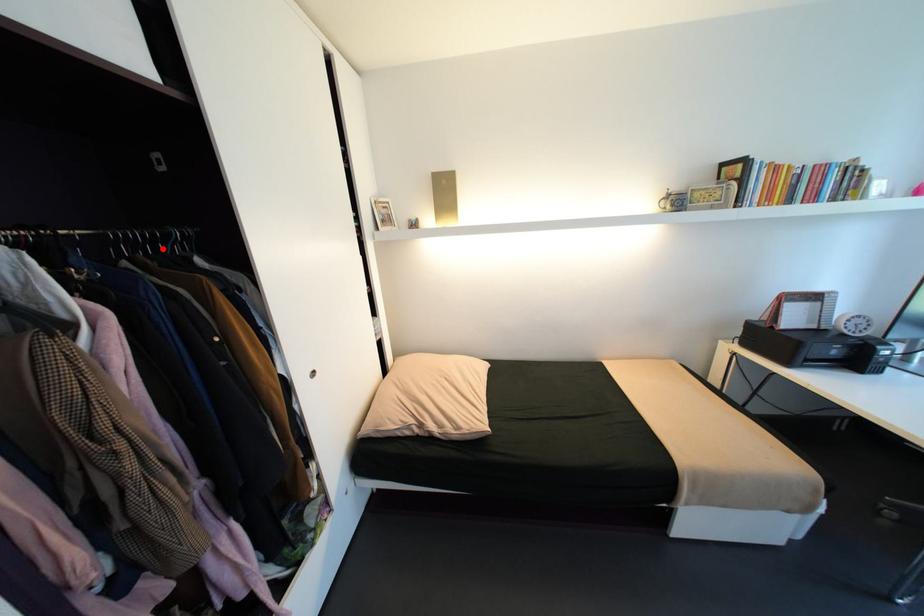
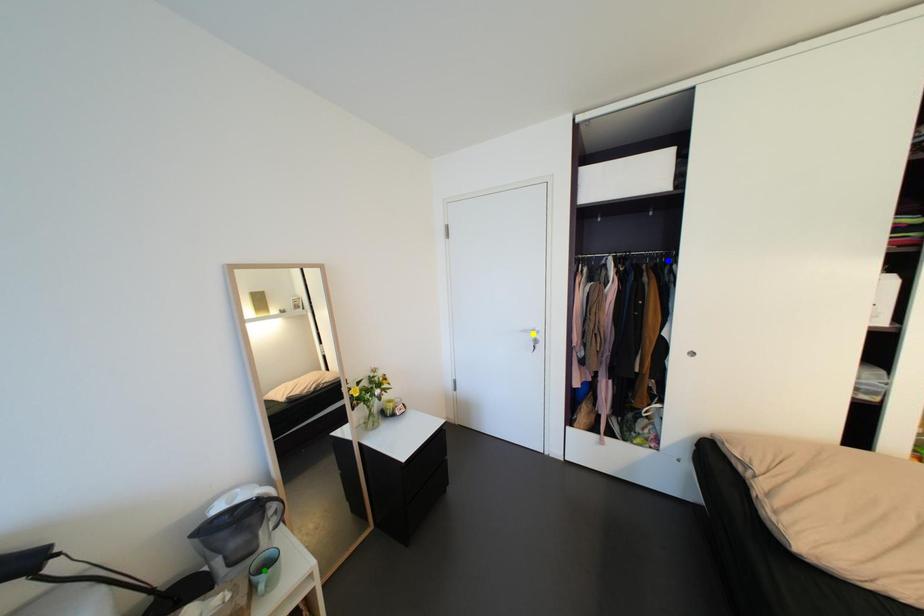
Question: I am providing you with two images of the same scene from different viewpoints. A red point is marked on the first image. You are given multiple points on the second image. Can you choose the point in image 2 that corresponds to the point in image 1?

Choices:
 (A) yellow point
 (B) blue point
 (C) green point

Answer: (B)